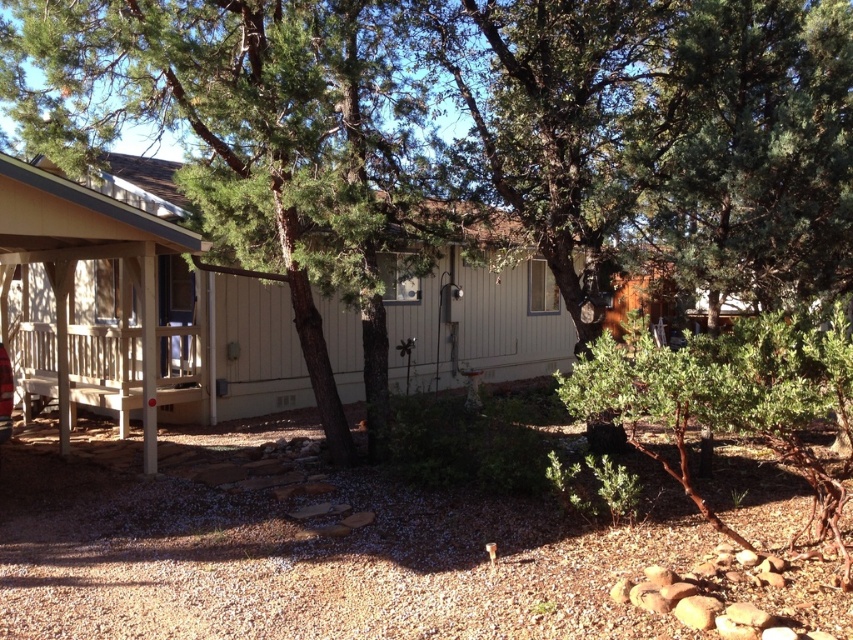
You are standing at the point marked as point (477, 323) in the image. What is the nearest object to you in the scene?

The nearest object to you is the beige wood porch at lower left since the point (477, 323) corresponds to it.

Consider the image. You are standing in front of the house and want to water the green leafy tree at center. If your garden hose can reach 25 feet, will you need to move closer to the tree?

The green leafy tree at center is 26.53 feet away from camera. Since the hose can only reach 25 feet, you will need to move closer to the tree to water it.

You are standing at the entrance of the beige wood porch at lower left and want to look at the green leafy tree at center. In which direction should you turn your head to see it?

The green leafy tree at center is located below the beige wood porch at lower left, so you should look downward to see it.